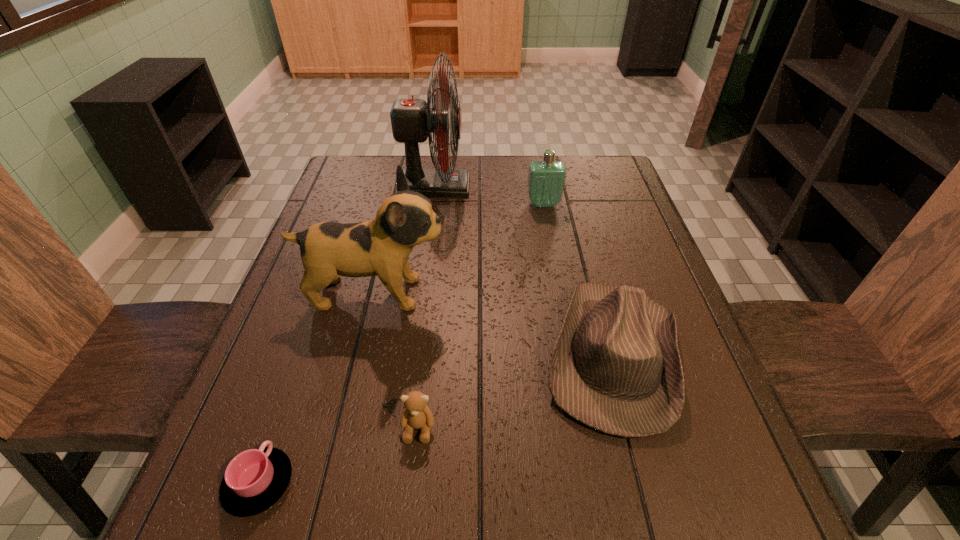
This screenshot has height=540, width=960. I want to click on vacant space that is in between the fedora and the tallest object, so click(x=524, y=271).

Where is `vacant area between the third tallest object and the fifth tallest object`? vacant area between the third tallest object and the fifth tallest object is located at coordinates (481, 316).

Find the location of a particular element. The height and width of the screenshot is (540, 960). empty space that is in between the fedora and the shortest object is located at coordinates (436, 418).

The image size is (960, 540). Identify the location of vacant space that is in between the teddy bear and the fedora. (516, 391).

The image size is (960, 540). What are the coordinates of `the second closest object relative to the teddy bear` in the screenshot? It's located at (616, 367).

The width and height of the screenshot is (960, 540). Find the location of `object that ranks as the third closest to the tallest object`. object that ranks as the third closest to the tallest object is located at coordinates (616, 367).

This screenshot has width=960, height=540. I want to click on vacant area that satisfies the following two spatial constraints: 1. on the front label of the fedora; 2. on the left side of the perfume, so click(570, 354).

Identify the location of vacant area in the image that satisfies the following two spatial constraints: 1. on the back side of the third shortest object; 2. on the front-facing side of the fan. (569, 187).

The image size is (960, 540). In order to click on vacant space that satisfies the following two spatial constraints: 1. on the side with the handle of the cup; 2. on the left side of the fedora in this screenshot , I will do `click(304, 354)`.

Find the location of a particular element. The width and height of the screenshot is (960, 540). free space that satisfies the following two spatial constraints: 1. on the back side of the fedora; 2. at the face of the puppy is located at coordinates (597, 293).